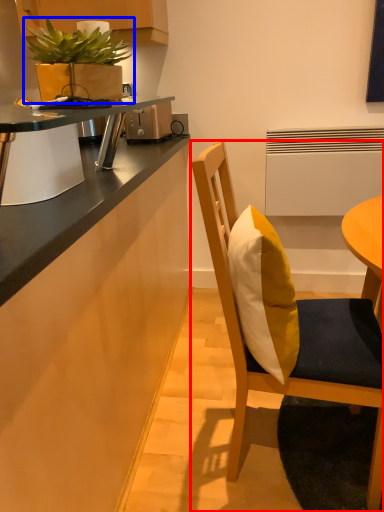
Question: Which point is closer to the camera, chair (highlighted by a red box) or houseplant (highlighted by a blue box)?

Choices:
 (A) chair
 (B) houseplant

Answer: (A)